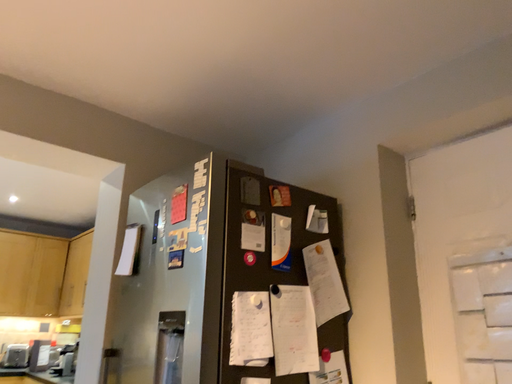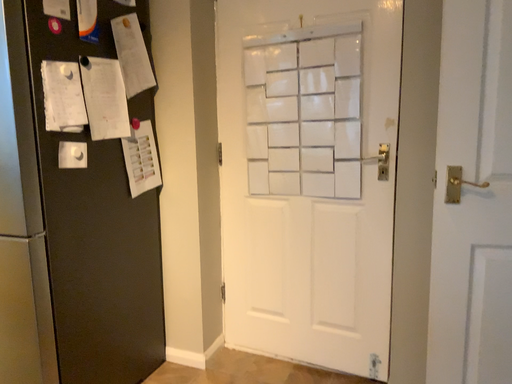
Question: How did the camera likely rotate when shooting the video?

Choices:
 (A) rotated right
 (B) rotated left

Answer: (A)